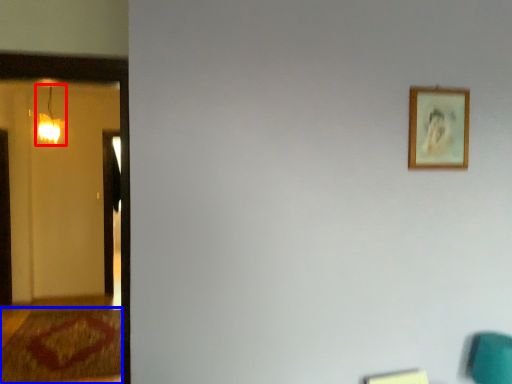
Question: Which point is further to the camera, lamp (highlighted by a red box) or doormat (highlighted by a blue box)?

Choices:
 (A) lamp
 (B) doormat

Answer: (A)